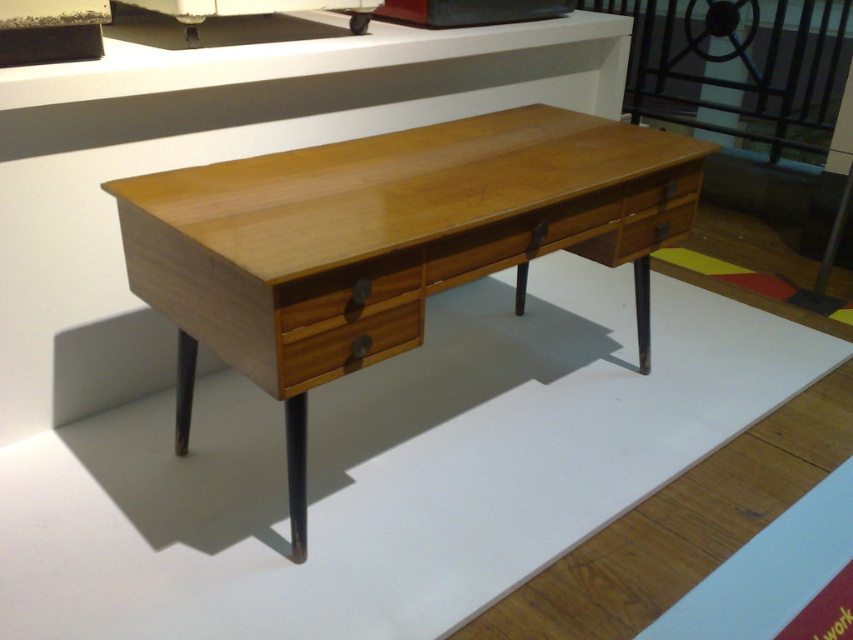
Consider the image. You are an interior designer arranging furniture in a museum. You have a light wood desk at center and a wooden drawer at center. According to the image, which object is positioned higher from the floor?

The light wood desk at center is located above the wooden drawer at center, so the light wood desk at center is higher from the floor.

You are an interior designer assessing the layout of the desk setup. You need to determine the spatial relationship between the light wood desk at center and the wooden drawer at center. Which object is closer to you from your viewing position?

The light wood desk at center is closer to you than the wooden drawer at center because the light wood desk at center is in front of wooden drawer at center.